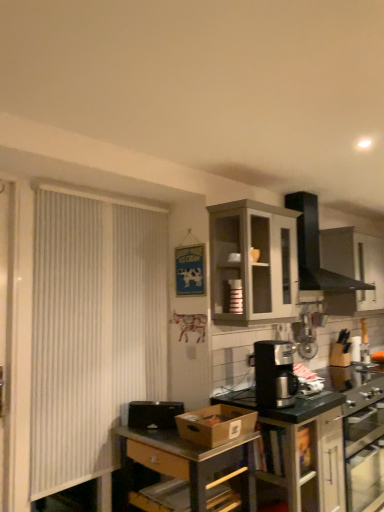
You are a GUI agent. You are given a task and a screenshot of the screen. Output one action in this format:
    pyautogui.click(x=<x>, y=<y>)
    Task: Click on the vacant space underneath black plastic bowl at center (from a real-world perspective)
    
    Given the screenshot: What is the action you would take?
    pyautogui.click(x=148, y=426)